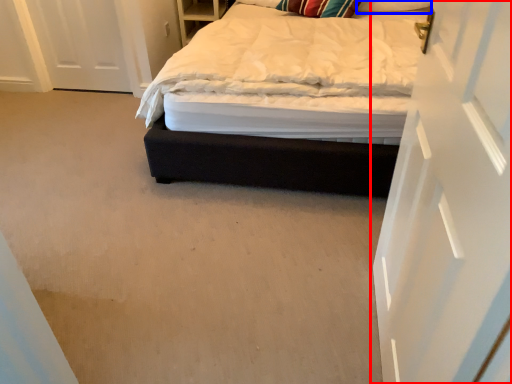
Question: Which object appears closest to the camera in this image, door (highlighted by a red box) or pillow (highlighted by a blue box)?

Choices:
 (A) door
 (B) pillow

Answer: (A)